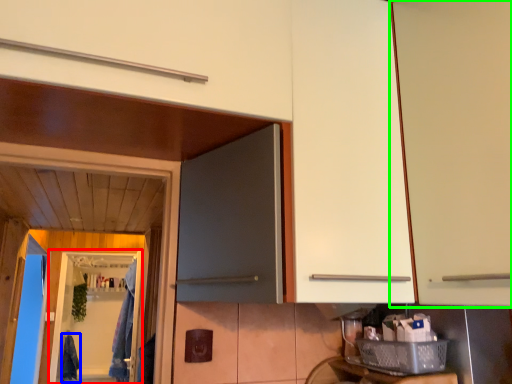
Question: Estimate the real-world distances between objects in this image. Which object is farther from screen door (highlighted by a red box), laundry (highlighted by a blue box) or cabinetry (highlighted by a green box)?

Choices:
 (A) laundry
 (B) cabinetry

Answer: (B)